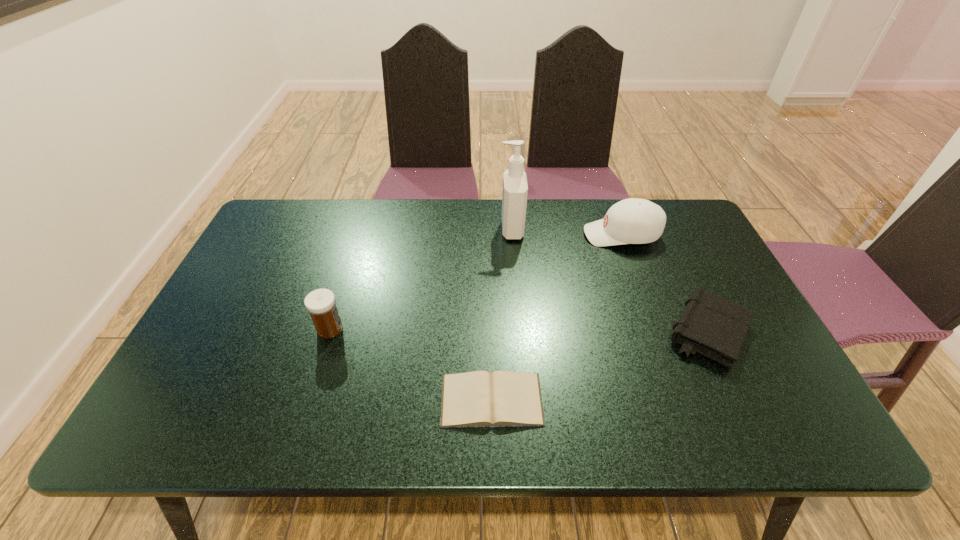
What are the coordinates of `vacant region that satisfies the following two spatial constraints: 1. on the back side of the right Bible; 2. on the front-facing side of the baseball cap` in the screenshot? It's located at (662, 235).

Identify the location of free space that satisfies the following two spatial constraints: 1. on the front label of the tallest object; 2. on the back side of the second shortest object. Image resolution: width=960 pixels, height=540 pixels. (519, 332).

You are a GUI agent. You are given a task and a screenshot of the screen. Output one action in this format:
    pyautogui.click(x=<x>, y=<y>)
    Task: Click on the vacant space that satisfies the following two spatial constraints: 1. on the front side of the taller Bible; 2. on the right side of the medicine
    The image size is (960, 540).
    Given the screenshot: What is the action you would take?
    pyautogui.click(x=329, y=332)

Find the location of `free point that satisfies the following two spatial constraints: 1. on the back side of the farther Bible; 2. on the front label of the cleansing agent`. free point that satisfies the following two spatial constraints: 1. on the back side of the farther Bible; 2. on the front label of the cleansing agent is located at coordinates (660, 230).

This screenshot has width=960, height=540. Find the location of `vacant space that satisfies the following two spatial constraints: 1. on the back side of the right Bible; 2. on the front label of the cleansing agent`. vacant space that satisfies the following two spatial constraints: 1. on the back side of the right Bible; 2. on the front label of the cleansing agent is located at coordinates tap(660, 230).